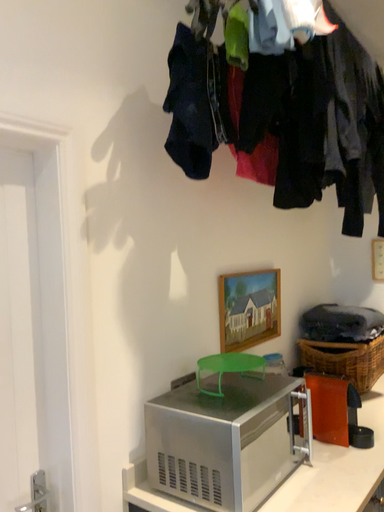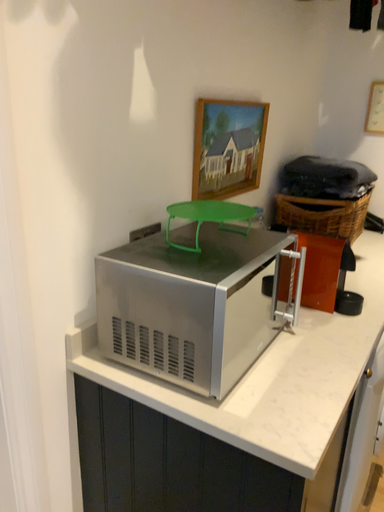
Question: How did the camera likely rotate when shooting the video?

Choices:
 (A) rotated upward
 (B) rotated downward

Answer: (B)